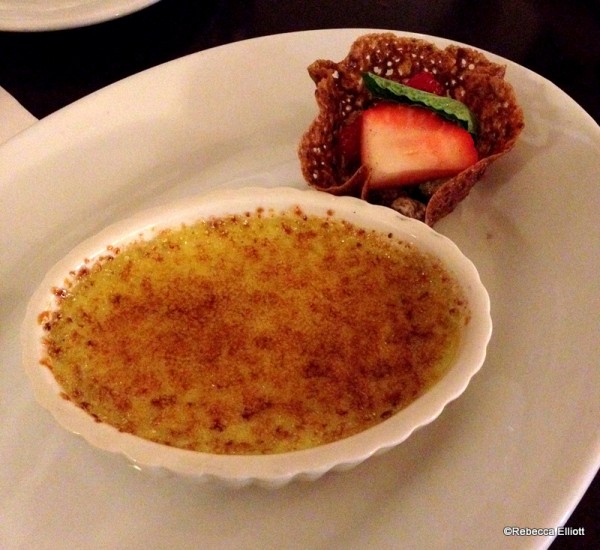
Where is `napkin`? This screenshot has width=600, height=550. napkin is located at coordinates (4, 100).